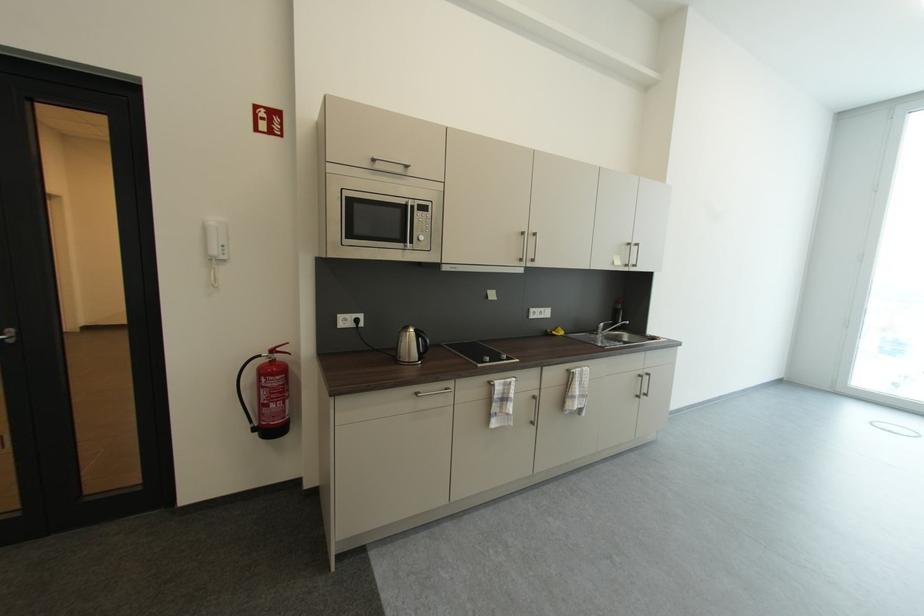
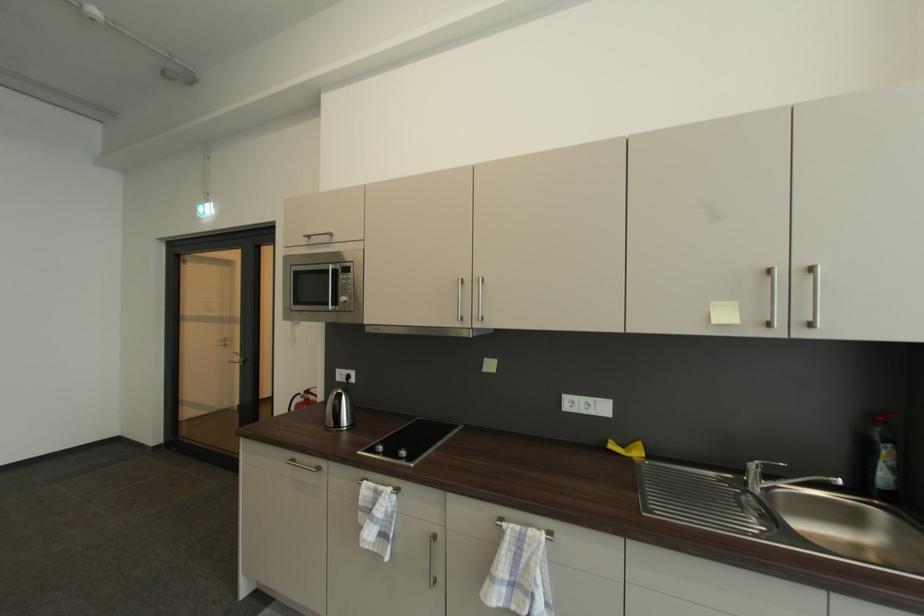
Find the pixel in the second image that matches [414,207] in the first image.

(334, 272)